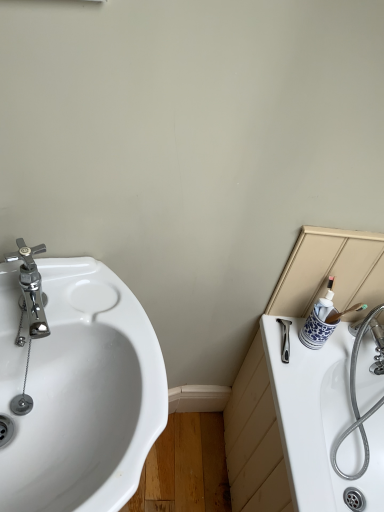
Question: Would you say chrome/metallic faucet at left is outside white glossy sink at left?

Choices:
 (A) yes
 (B) no

Answer: (B)

Question: Is chrome/metallic faucet at left wider than white glossy sink at left?

Choices:
 (A) no
 (B) yes

Answer: (A)

Question: Is the depth of chrome/metallic faucet at left greater than that of white glossy sink at left?

Choices:
 (A) yes
 (B) no

Answer: (A)

Question: Does chrome/metallic faucet at left come in front of white glossy sink at left?

Choices:
 (A) yes
 (B) no

Answer: (B)

Question: From the image's perspective, is chrome/metallic faucet at left on white glossy sink at left?

Choices:
 (A) yes
 (B) no

Answer: (A)

Question: Is blue and white ceramic cup at right in front of or behind chrome/metallic faucet at left in the image?

Choices:
 (A) behind
 (B) front

Answer: (A)

Question: Is blue and white ceramic cup at right inside or outside of chrome/metallic faucet at left?

Choices:
 (A) inside
 (B) outside

Answer: (B)

Question: Considering the positions of blue and white ceramic cup at right and chrome/metallic faucet at left in the image, is blue and white ceramic cup at right wider or thinner than chrome/metallic faucet at left?

Choices:
 (A) wide
 (B) thin

Answer: (B)

Question: Considering the positions of blue and white ceramic cup at right and chrome/metallic faucet at left in the image, is blue and white ceramic cup at right taller or shorter than chrome/metallic faucet at left?

Choices:
 (A) tall
 (B) short

Answer: (A)

Question: Is chrome/metallic faucet at left to the left or to the right of white glossy sink at left in the image?

Choices:
 (A) left
 (B) right

Answer: (A)

Question: From a real-world perspective, is chrome/metallic faucet at left above or below white glossy sink at left?

Choices:
 (A) below
 (B) above

Answer: (B)

Question: In terms of width, does chrome/metallic faucet at left look wider or thinner when compared to white glossy sink at left?

Choices:
 (A) thin
 (B) wide

Answer: (A)

Question: From the image's perspective, relative to white glossy sink at left, is chrome/metallic faucet at left above or below?

Choices:
 (A) above
 (B) below

Answer: (A)

Question: Considering the positions of point (3, 470) and point (24, 295), is point (3, 470) closer or farther from the camera than point (24, 295)?

Choices:
 (A) farther
 (B) closer

Answer: (B)

Question: Is white glossy sink at left spatially inside chrome/metallic faucet at left, or outside of it?

Choices:
 (A) inside
 (B) outside

Answer: (B)